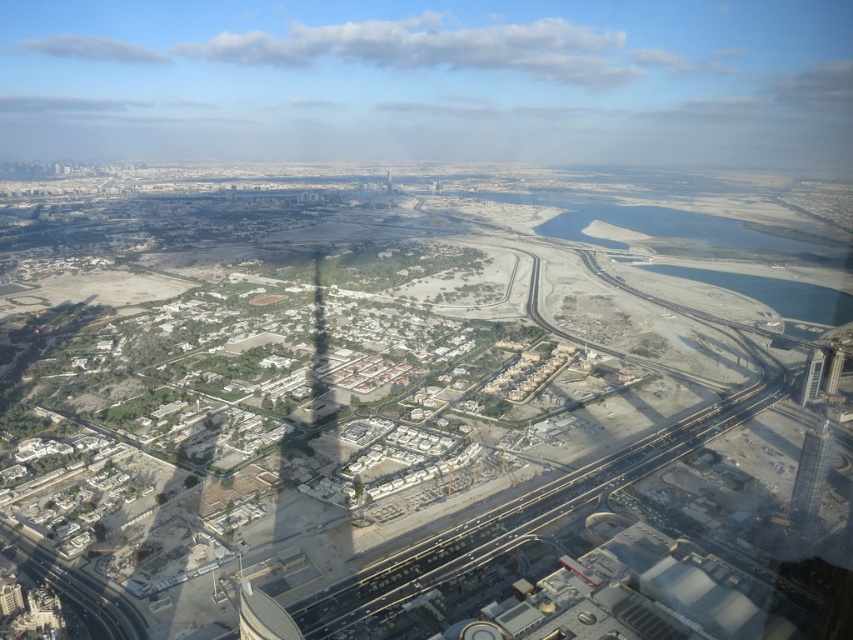
Question: Which object appears farthest from the camera in this image?

Choices:
 (A) metallic glass tower at right
 (B) smooth glass skyscraper at center
 (C) clear glass window at center

Answer: (B)

Question: Is metallic glass tower at right further to camera compared to smooth glass skyscraper at center?

Choices:
 (A) no
 (B) yes

Answer: (A)

Question: Does metallic glass tower at lower right appear on the right side of metallic glass tower at right?

Choices:
 (A) yes
 (B) no

Answer: (B)

Question: Estimate the real-world distances between objects in this image. Which object is closer to the metallic glass tower at lower right?

Choices:
 (A) metallic glass tower at right
 (B) smooth glass skyscraper at center
 (C) clear glass window at center
 (D) smooth glass tower at center

Answer: (A)

Question: Which object appears farthest from the camera in this image?

Choices:
 (A) metallic glass tower at lower right
 (B) clear glass window at center
 (C) metallic glass tower at right
 (D) smooth glass skyscraper at center

Answer: (D)

Question: Is metallic glass tower at right bigger than smooth glass skyscraper at center?

Choices:
 (A) no
 (B) yes

Answer: (B)